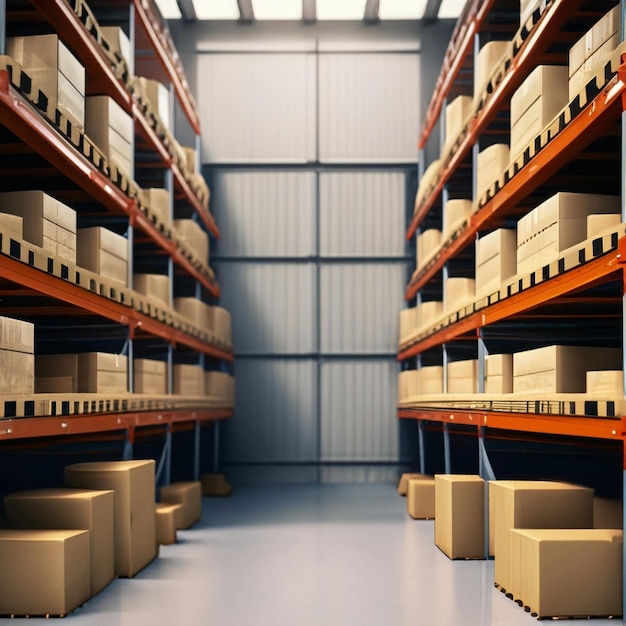
What are the coordinates of `boxes on first shelf` in the screenshot? It's located at (9, 380), (103, 376), (149, 374), (188, 372), (221, 386), (531, 369), (501, 374), (458, 384), (422, 386), (397, 387).